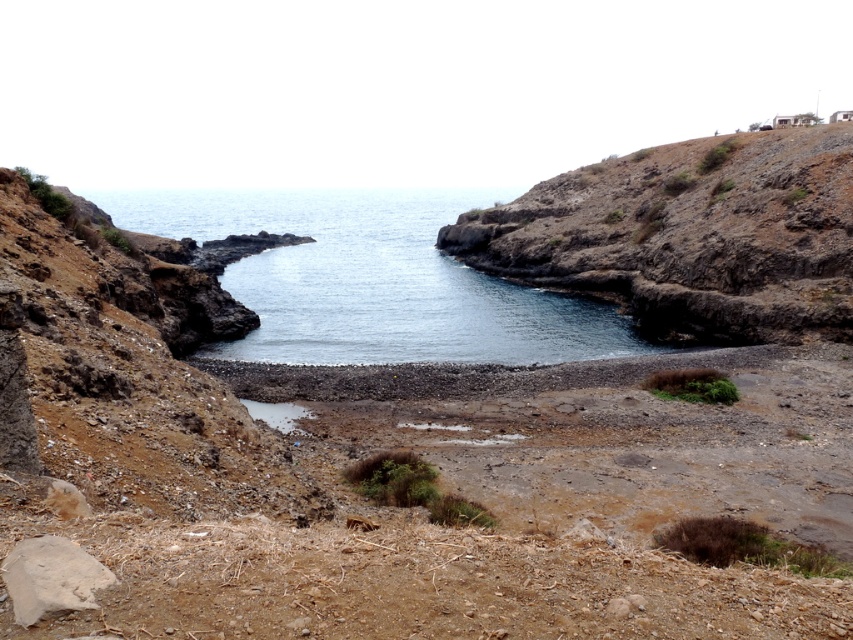
Who is lower down, clear water at center or brown rough rock at lower left?

brown rough rock at lower left is lower down.

Which is more to the right, clear water at center or brown rough rock at lower left?

brown rough rock at lower left is more to the right.

Describe the element at coordinates (373, 280) in the screenshot. Image resolution: width=853 pixels, height=640 pixels. I see `clear water at center` at that location.

You are a GUI agent. You are given a task and a screenshot of the screen. Output one action in this format:
    pyautogui.click(x=<x>, y=<y>)
    Task: Click on the clear water at center
    Image resolution: width=853 pixels, height=640 pixels.
    Given the screenshot: What is the action you would take?
    pyautogui.click(x=373, y=280)

Is the position of dull brown rock at upper right more distant than that of clear water at center?

No, dull brown rock at upper right is closer to the viewer.

Who is higher up, dull brown rock at upper right or clear water at center?

clear water at center is above.

The image size is (853, 640). What do you see at coordinates (689, 236) in the screenshot?
I see `dull brown rock at upper right` at bounding box center [689, 236].

The width and height of the screenshot is (853, 640). In order to click on dull brown rock at upper right in this screenshot , I will do `click(689, 236)`.

Who is taller, dull brown dirt at left or brown rough rock at lower left?

Standing taller between the two is dull brown dirt at left.

Who is more forward, (x=138, y=284) or (x=67, y=604)?

Point (x=67, y=604)

What do you see at coordinates (128, 365) in the screenshot? I see `dull brown dirt at left` at bounding box center [128, 365].

You are a GUI agent. You are given a task and a screenshot of the screen. Output one action in this format:
    pyautogui.click(x=<x>, y=<y>)
    Task: Click on the dull brown dirt at left
    The height and width of the screenshot is (640, 853).
    Given the screenshot: What is the action you would take?
    pyautogui.click(x=128, y=365)